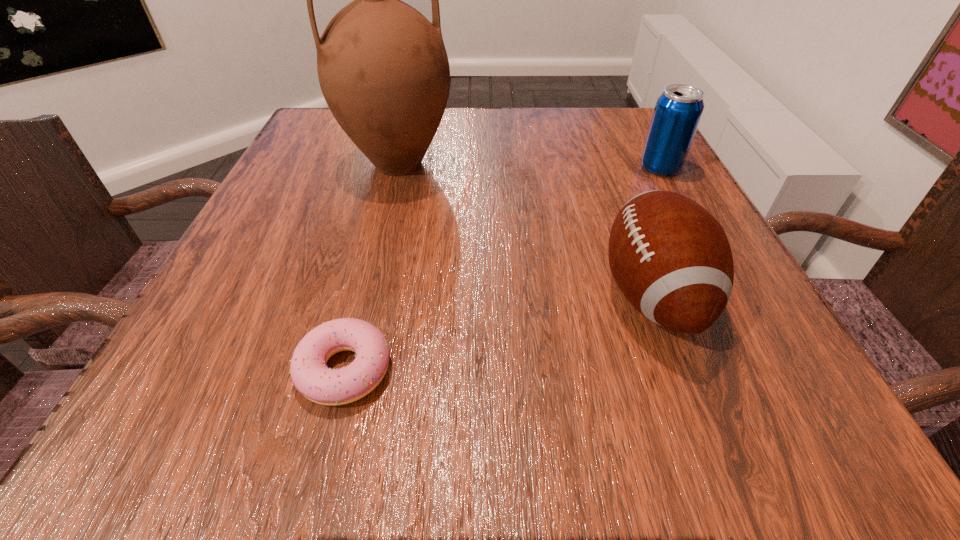
In order to click on free region at the left edge of the desktop in this screenshot , I will do `click(265, 238)`.

Locate an element on the screen. This screenshot has height=540, width=960. vacant region at the near left corner of the desktop is located at coordinates (151, 388).

Find the location of `free spot at the far right corner of the desktop`. free spot at the far right corner of the desktop is located at coordinates (636, 133).

Where is `free space that is in between the doughnut and the pitcher`? The image size is (960, 540). free space that is in between the doughnut and the pitcher is located at coordinates (372, 267).

Where is `free space between the pop soda and the tallest object`? free space between the pop soda and the tallest object is located at coordinates (529, 166).

You are a GUI agent. You are given a task and a screenshot of the screen. Output one action in this format:
    pyautogui.click(x=<x>, y=<y>)
    Task: Click on the vacant point located between the shortest object and the pop soda
    
    Given the screenshot: What is the action you would take?
    pyautogui.click(x=503, y=268)

Locate an element on the screen. vacant area that lies between the pop soda and the pitcher is located at coordinates (529, 166).

The image size is (960, 540). What are the coordinates of `vacant area that lies between the tallest object and the doughnut` in the screenshot? It's located at (372, 267).

At what (x,y) coordinates should I click in order to perform the action: click on vacant space that is in between the shortest object and the tallest object. Please return your answer as a coordinate pair (x, y). The width and height of the screenshot is (960, 540). Looking at the image, I should click on (372, 267).

The height and width of the screenshot is (540, 960). I want to click on free space between the football and the shortest object, so click(x=498, y=332).